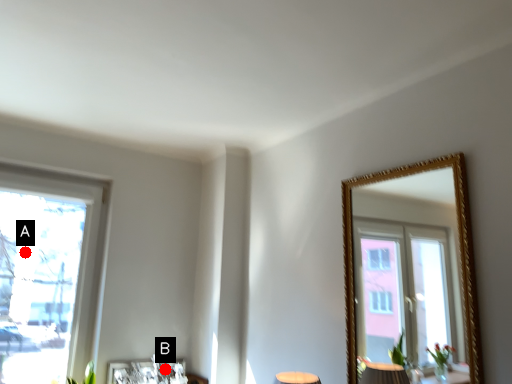
Question: Two points are circled on the image, labeled by A and B beside each circle. Which point is farther from the camera taking this photo?

Choices:
 (A) A is further
 (B) B is further

Answer: (B)